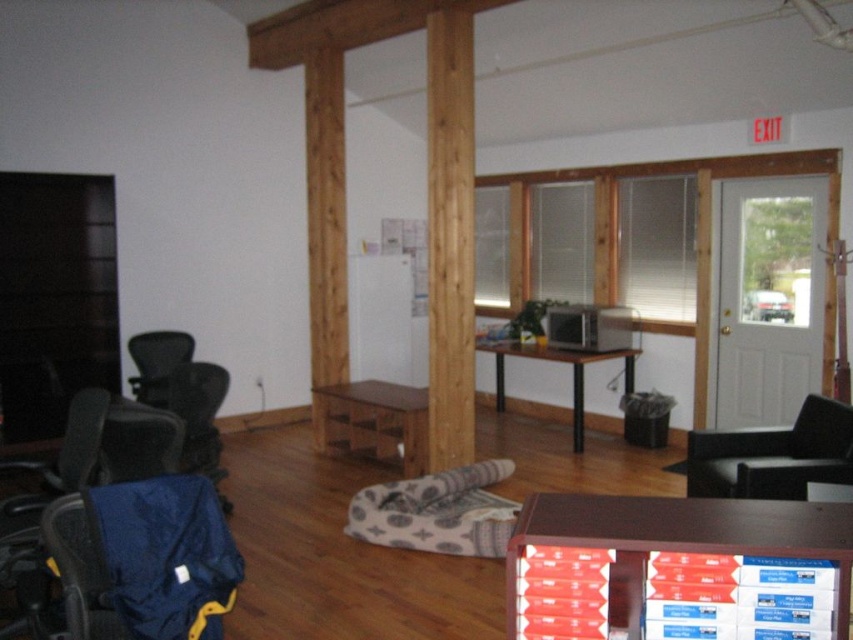
You are an office worker who needs to move from your desk to the printer located behind the blue fabric chair at lower left and the black leather swivel chair at lower right. Which chair should you move out of the way first to access the printer?

The blue fabric chair at lower left is below the black leather swivel chair at lower right, so you should move the blue fabric chair at lower left first to access the printer.

You are standing in the office and want to place a 1.5 meter long ladder against the wall. The ladder needs to be placed near the brown wooden table at lower right. Is there enough space between you and the table to place the ladder?

The distance between you and the brown wooden table at lower right is 1.65 meters. Since the ladder is 1.5 meters long, there is sufficient space to place it near the table.

You are organizing a meeting in this office and need to place a round table between the natural wood pillar at center and the wooden pillar at center. Which pillar should the table be closer to if you want it to be near the thinner one?

The natural wood pillar at center is thinner than the wooden pillar at center, so the round table should be placed closer to the natural wood pillar at center to be near the thinner one.